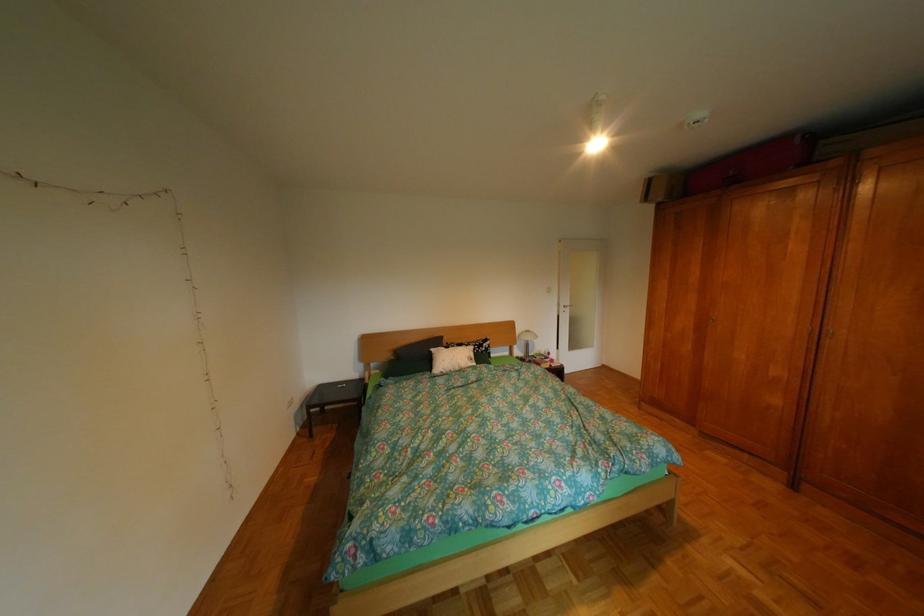
Which object does [526,341] point to?

It refers to a table lamp.